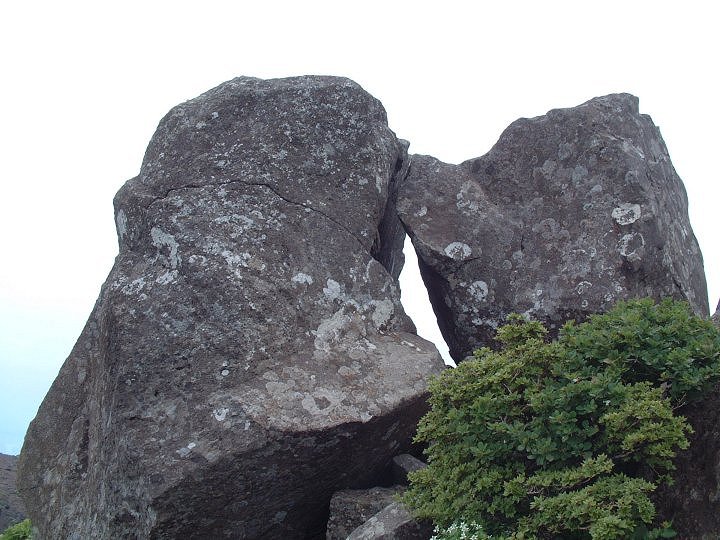
In order to click on black shade in this screenshot , I will do `click(312, 526)`.